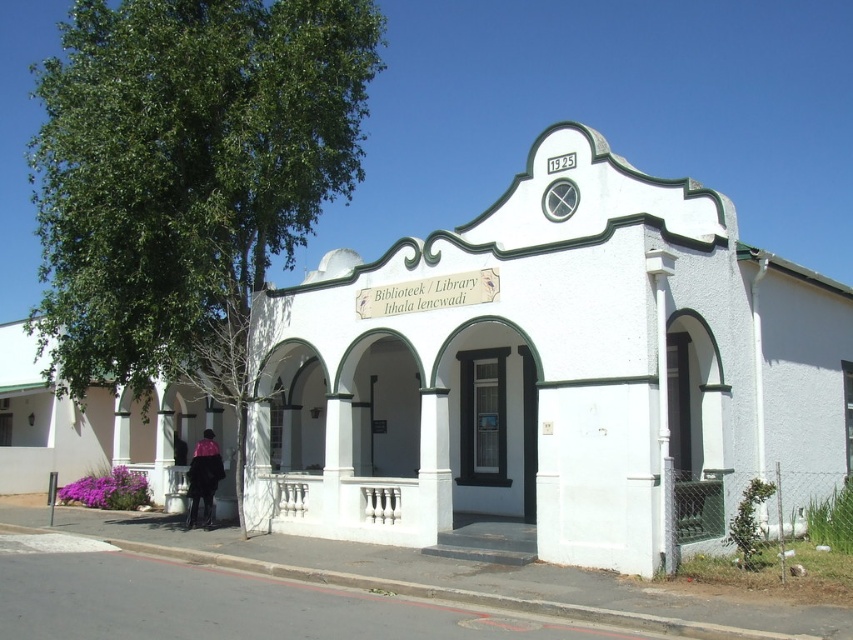
In the scene shown: Is white painted wall at center positioned behind velvet purple coat at lower left?

No, it is not.

Between white painted wall at center and velvet purple coat at lower left, which one appears on the left side from the viewer's perspective?

velvet purple coat at lower left is more to the left.

Between point (807, 413) and point (200, 468), which one is positioned behind?

The point (200, 468) is more distant.

You are a GUI agent. You are given a task and a screenshot of the screen. Output one action in this format:
    pyautogui.click(x=<x>, y=<y>)
    Task: Click on the white painted wall at center
    Image resolution: width=853 pixels, height=640 pixels.
    Given the screenshot: What is the action you would take?
    point(550,376)